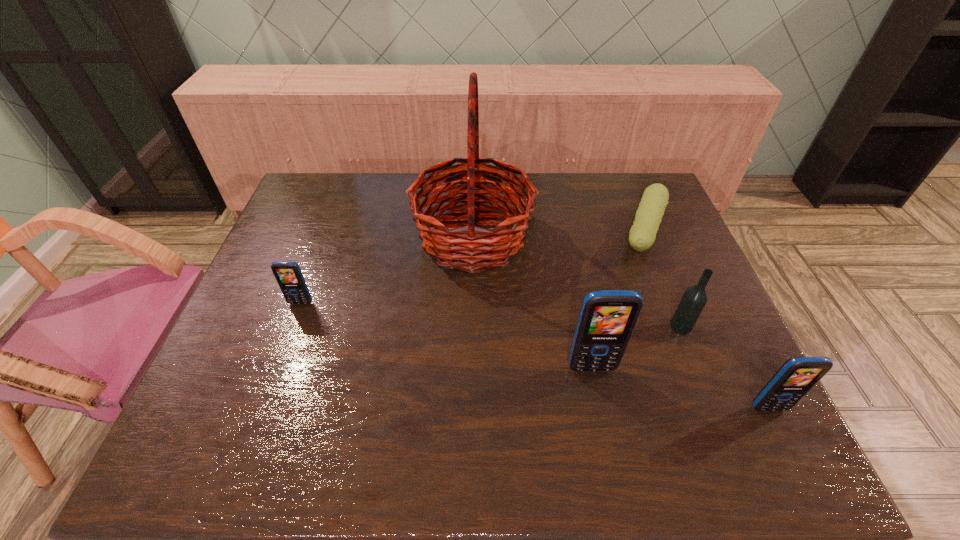
Find the location of a particular element. spot to insert another cellular_telephone for uniform distribution is located at coordinates (x=437, y=334).